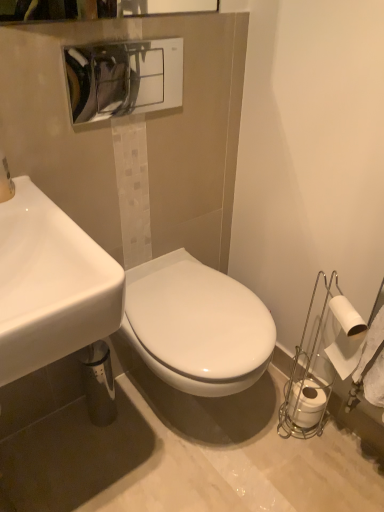
Question: Is white matte toilet paper at lower right, the first toilet paper in the top-to-bottom sequence, behind white glossy sink at left, the 2th sink viewed from the back?

Choices:
 (A) yes
 (B) no

Answer: (A)

Question: Is white matte toilet paper at lower right, the second toilet paper in the bottom-to-top sequence, placed right next to white glossy sink at left, the 2th sink viewed from the back?

Choices:
 (A) yes
 (B) no

Answer: (B)

Question: From a real-world perspective, is white matte toilet paper at lower right, the second toilet paper in the bottom-to-top sequence, under white glossy sink at left, the 2th sink viewed from the back?

Choices:
 (A) no
 (B) yes

Answer: (B)

Question: Is white matte toilet paper at lower right, the second toilet paper from the back, taller than white glossy sink at left, the 1th sink when ordered from front to back?

Choices:
 (A) no
 (B) yes

Answer: (A)

Question: Is white matte toilet paper at lower right, the second toilet paper in the bottom-to-top sequence, facing away from white glossy sink at left, the 1th sink when ordered from front to back?

Choices:
 (A) no
 (B) yes

Answer: (A)

Question: Is white matte toilet paper at lower right, the second toilet paper in the bottom-to-top sequence, aimed at white glossy sink at left, the 2th sink viewed from the back?

Choices:
 (A) yes
 (B) no

Answer: (A)

Question: Considering the relative sizes of white glossy sink at center, which is the first sink in back-to-front order, and white glossy sink at left, the 2th sink viewed from the back, in the image provided, is white glossy sink at center, which is the first sink in back-to-front order, taller than white glossy sink at left, the 2th sink viewed from the back,?

Choices:
 (A) no
 (B) yes

Answer: (B)

Question: Does white glossy sink at center, which is the first sink in back-to-front order, have a smaller size compared to white glossy sink at left, the 1th sink when ordered from front to back?

Choices:
 (A) no
 (B) yes

Answer: (B)

Question: Can we say white glossy sink at center, which is the first sink in back-to-front order, lies outside white glossy sink at left, the 1th sink when ordered from front to back?

Choices:
 (A) no
 (B) yes

Answer: (B)

Question: Does white glossy sink at center, which is the first sink in back-to-front order, have a greater width compared to white glossy sink at left, the 2th sink viewed from the back?

Choices:
 (A) no
 (B) yes

Answer: (A)

Question: Can you confirm if white glossy sink at center, the 2th sink in the front-to-back sequence, is positioned to the right of white glossy sink at left, the 2th sink viewed from the back?

Choices:
 (A) no
 (B) yes

Answer: (B)

Question: Can you confirm if white glossy sink at center, which is the first sink in back-to-front order, is shorter than white glossy sink at left, the 1th sink when ordered from front to back?

Choices:
 (A) yes
 (B) no

Answer: (B)

Question: Is white matte toilet paper at lower right, the second toilet paper from the back, closer to the viewer compared to white matte toilet paper at lower right, the first toilet paper from the bottom?

Choices:
 (A) yes
 (B) no

Answer: (A)